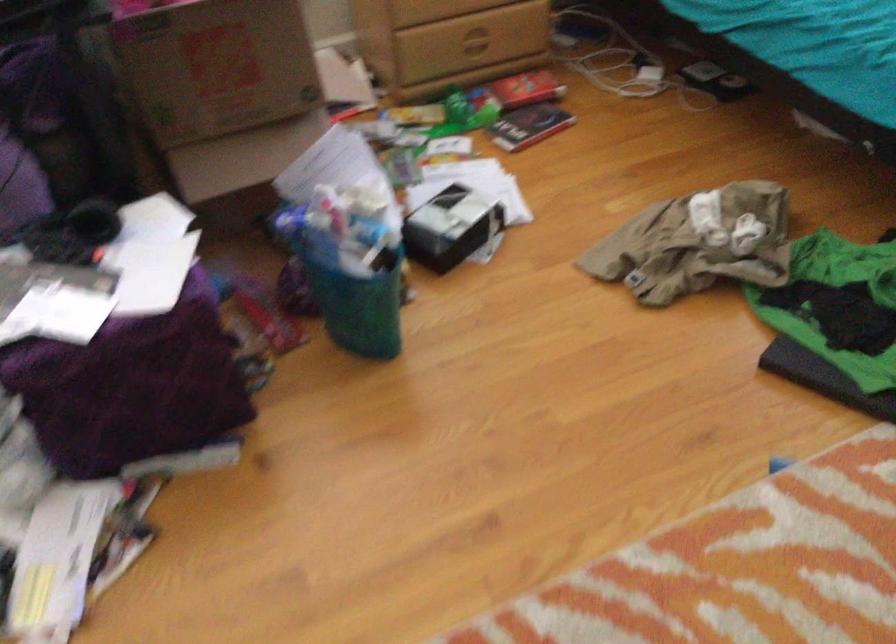
Image resolution: width=896 pixels, height=644 pixels. I want to click on wooden drawer handle, so pyautogui.click(x=472, y=40).